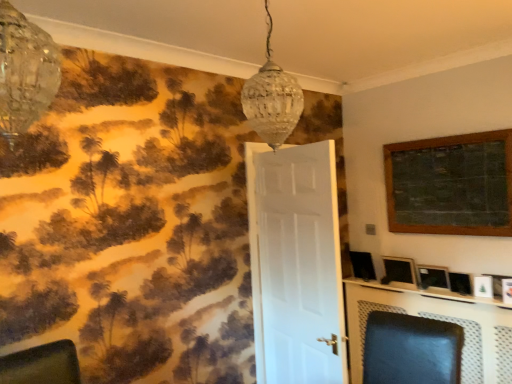
Question: From the image's perspective, is matte black picture frame at right, the first picture frame when ordered from bottom to top, above or below wooden framed chalkboard at upper right, the fourth picture frame from the bottom?

Choices:
 (A) below
 (B) above

Answer: (A)

Question: Is matte black picture frame at right, the 4th picture frame positioned from the top, in front of or behind wooden framed chalkboard at upper right, the first picture frame in the top-to-bottom sequence, in the image?

Choices:
 (A) front
 (B) behind

Answer: (B)

Question: Considering the real-world distances, which object is farthest from the clear glass chandelier at upper left, which is counted as the 2th lamp, starting from the right?

Choices:
 (A) matte black picture frame at right, acting as the second picture frame starting from the top
 (B) clear glass pendant light at upper center, which appears as the first lamp when viewed from the back
 (C) wooden picture frame at upper right, the 2th picture frame from the bottom
 (D) white matte door at center
 (E) metallic silver tv at lower right

Answer: (E)

Question: Which of these objects is positioned farthest from the wooden picture frame at upper right, the 2th picture frame from the bottom?

Choices:
 (A) matte black swivel chair at center
 (B) matte black picture frame at right, the 4th picture frame positioned from the top
 (C) metallic silver tv at lower right
 (D) wooden framed chalkboard at upper right, the fourth picture frame from the bottom
 (E) clear glass chandelier at upper left, placed as the 2th lamp when sorted from back to front

Answer: (E)